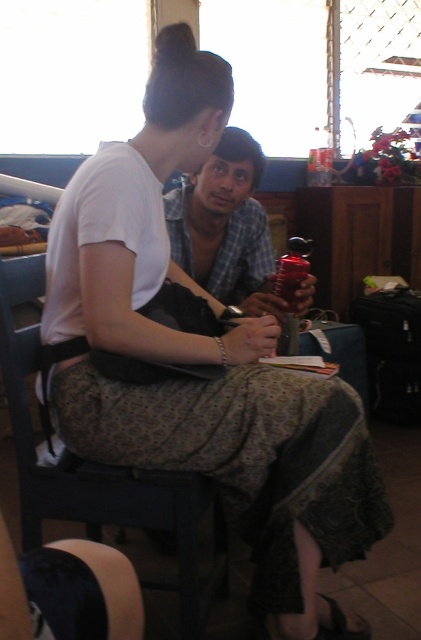
You are a person who wants to place a small book on the surface of the dark wood chair at center without it falling off. Considering the matte plastic water bottle at center is already on the chair, is the height of the chair sufficient to prevent the book from slipping off the edge?

The dark wood chair at center has a greater height compared to matte plastic water bottle at center, so the height of the chair is sufficient to prevent the book from slipping off the edge as long as the book is placed properly on the surface.

You are a photographer setting up for a portrait. You need to ensure that the dark wood chair at center and the matte plastic water bottle at center are both in focus. Given that your camera can only focus on objects within the same vertical plane, can you confirm if their positions allow for this?

The dark wood chair at center is located below the matte plastic water bottle at center, so they are not in the same vertical plane. Therefore, the camera cannot focus on both simultaneously.

You are organizing a small meeting in a room with limited space. You need to place both the dark wood chair at center and the matte plastic water bottle at center on a table that can only accommodate one large item. Which item should you place on the table first?

The dark wood chair at center is bigger than the matte plastic water bottle at center, so you should place the dark wood chair at center first to ensure it fits on the table.